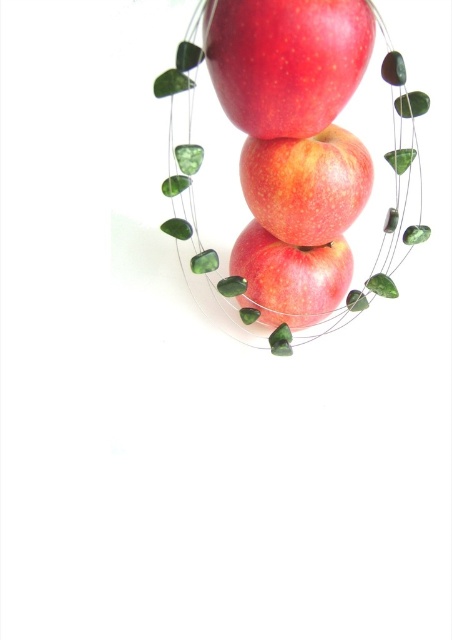
You are an apple vendor arranging apples in a display. You have two apples in the center of the display. One is labeled as shiny red apple at center and the other as glossy red apple at center. From your perspective, which apple is positioned to the left?

The shiny red apple at center is positioned to the left of the glossy red apple at center.

You are an apple vendor arranging apples in a display. You have two apples at the center of the display, a shiny red apple at center and a red matte apple at center. Which apple would a customer see first when looking at the display?

The shiny red apple at center is closer to the viewer than the red matte apple at center, so customers would see the shiny red apple at center first.